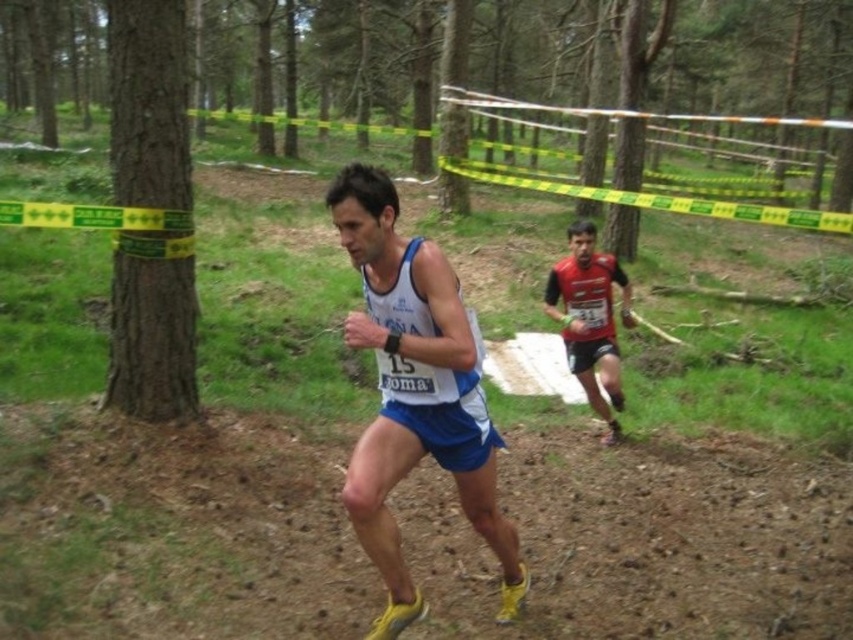
Question: Which point is farther from the camera taking this photo?

Choices:
 (A) (432, 308)
 (B) (575, 316)

Answer: (B)

Question: Which point is farther to the camera?

Choices:
 (A) brown dirt track at center
 (B) matte red running suit at center
 (C) white fabric tank top at center

Answer: (B)

Question: Which object is closer to the camera taking this photo?

Choices:
 (A) white fabric tank top at center
 (B) brown dirt track at center

Answer: (A)

Question: Can you confirm if white fabric tank top at center is positioned above matte red running suit at center?

Choices:
 (A) no
 (B) yes

Answer: (A)

Question: Does brown dirt track at center come in front of white fabric tank top at center?

Choices:
 (A) yes
 (B) no

Answer: (B)

Question: Does white fabric tank top at center appear over matte red running suit at center?

Choices:
 (A) yes
 (B) no

Answer: (B)